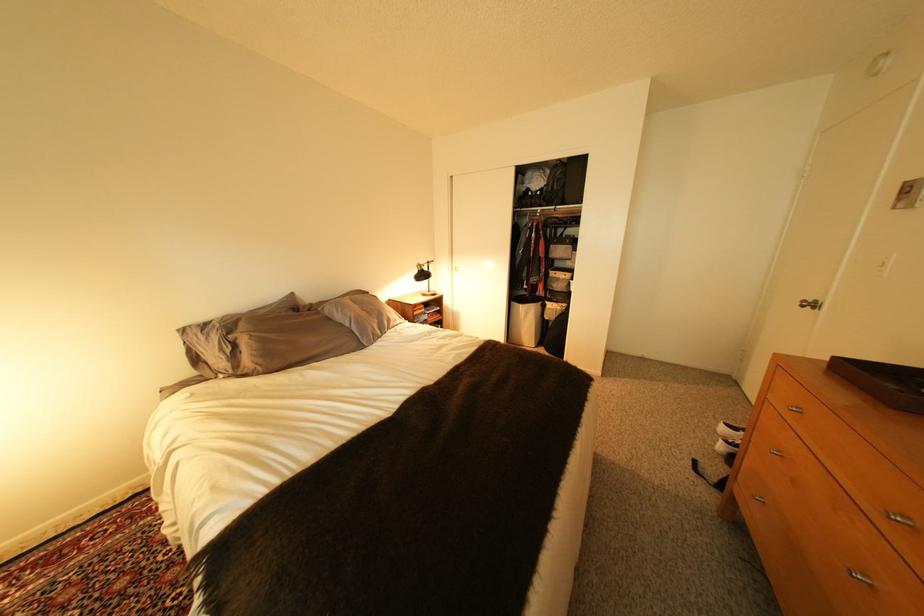
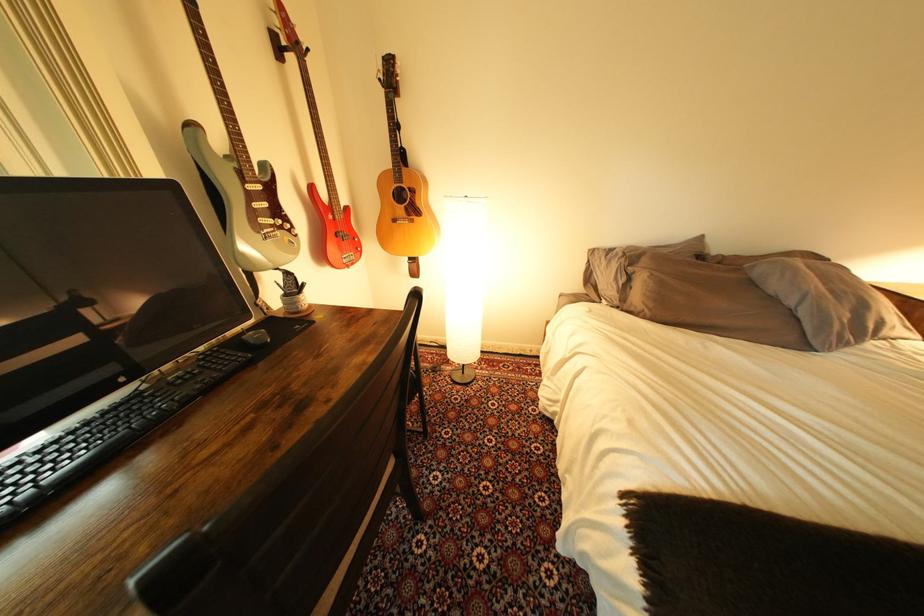
Find the pixel in the second image that matches the point at 307,362 in the first image.

(701, 322)